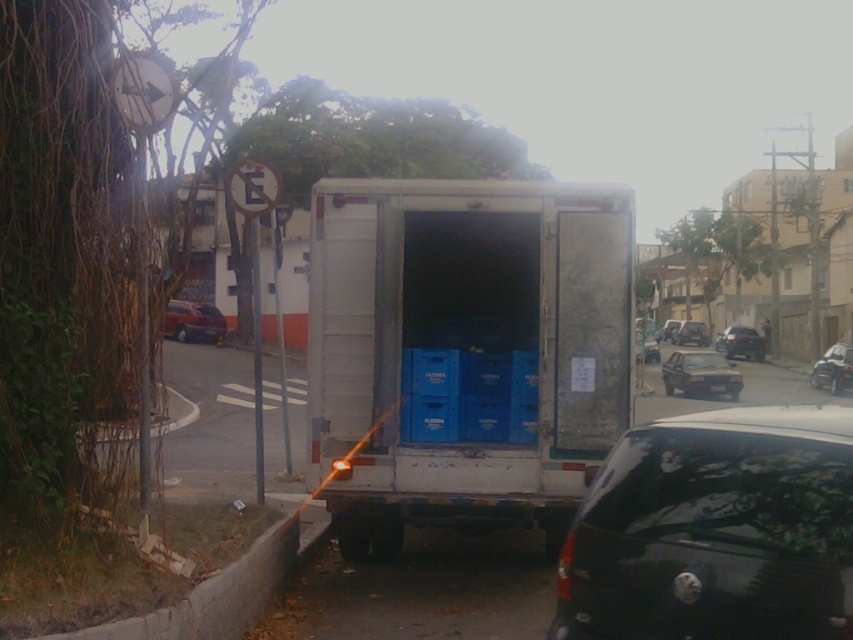
Question: Which of the following is the farthest from the observer?

Choices:
 (A) shiny red sedan at left
 (B) concrete at lower left

Answer: (A)

Question: Is concrete at lower left above white plastic license plate at center?

Choices:
 (A) yes
 (B) no

Answer: (B)

Question: Which of the following is the farthest from the observer?

Choices:
 (A) (257, 596)
 (B) (734, 401)
 (C) (810, 372)

Answer: (C)

Question: Can you confirm if concrete at lower left is positioned to the right of metallic silver car at center?

Choices:
 (A) no
 (B) yes

Answer: (A)

Question: Which of the following is the farthest from the observer?

Choices:
 (A) (679, 600)
 (B) (677, 340)
 (C) (218, 330)

Answer: (B)

Question: Does concrete at lower left have a lesser width compared to shiny red sedan at left?

Choices:
 (A) no
 (B) yes

Answer: (B)